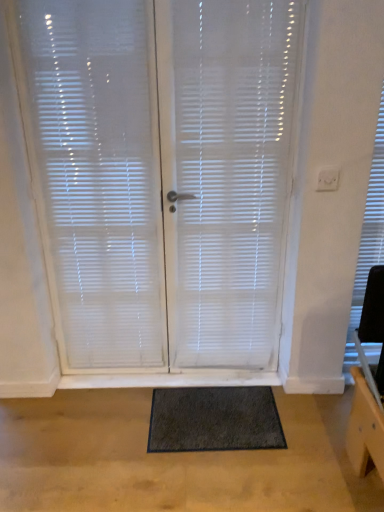
Question: From a real-world perspective, is white painted wood at lower center located beneath white translucent blinds at center?

Choices:
 (A) yes
 (B) no

Answer: (A)

Question: Considering the relative sizes of white painted wood at lower center and white translucent blinds at center in the image provided, is white painted wood at lower center taller than white translucent blinds at center?

Choices:
 (A) yes
 (B) no

Answer: (B)

Question: Is white painted wood at lower center far away from white translucent blinds at center?

Choices:
 (A) no
 (B) yes

Answer: (A)

Question: Considering the relative positions of white painted wood at lower center and white translucent blinds at center in the image provided, is white painted wood at lower center in front of white translucent blinds at center?

Choices:
 (A) yes
 (B) no

Answer: (B)

Question: Can we say white painted wood at lower center lies outside white translucent blinds at center?

Choices:
 (A) yes
 (B) no

Answer: (A)

Question: Is point (216, 446) positioned closer to the camera than point (94, 87)?

Choices:
 (A) farther
 (B) closer

Answer: (A)

Question: Is dark gray shaggy mat at center to the left or to the right of white translucent blinds at center in the image?

Choices:
 (A) left
 (B) right

Answer: (B)

Question: Is dark gray shaggy mat at center taller or shorter than white translucent blinds at center?

Choices:
 (A) short
 (B) tall

Answer: (A)

Question: In terms of size, does dark gray shaggy mat at center appear bigger or smaller than white translucent blinds at center?

Choices:
 (A) big
 (B) small

Answer: (B)

Question: Do you think white translucent blinds at center is within dark gray shaggy mat at center, or outside of it?

Choices:
 (A) inside
 (B) outside

Answer: (B)

Question: Would you say white translucent blinds at center is to the left or to the right of dark gray shaggy mat at center in the picture?

Choices:
 (A) left
 (B) right

Answer: (B)

Question: Is white translucent blinds at center taller or shorter than dark gray shaggy mat at center?

Choices:
 (A) short
 (B) tall

Answer: (B)

Question: In terms of width, does white translucent blinds at center look wider or thinner when compared to dark gray shaggy mat at center?

Choices:
 (A) wide
 (B) thin

Answer: (B)

Question: Considering the positions of white translucent blinds at center and dark gray shaggy mat at center in the image, is white translucent blinds at center bigger or smaller than dark gray shaggy mat at center?

Choices:
 (A) small
 (B) big

Answer: (B)

Question: From a real-world perspective, is white translucent blinds at center above or below dark gray shaggy mat at center?

Choices:
 (A) below
 (B) above

Answer: (B)